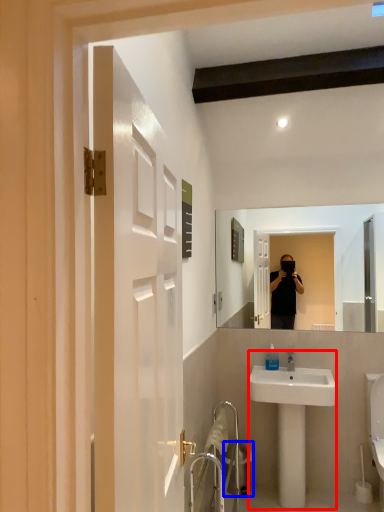
Question: Among these objects, which one is nearest to the camera, sink (highlighted by a red box) or trash bin/can (highlighted by a blue box)?

Choices:
 (A) sink
 (B) trash bin/can

Answer: (A)